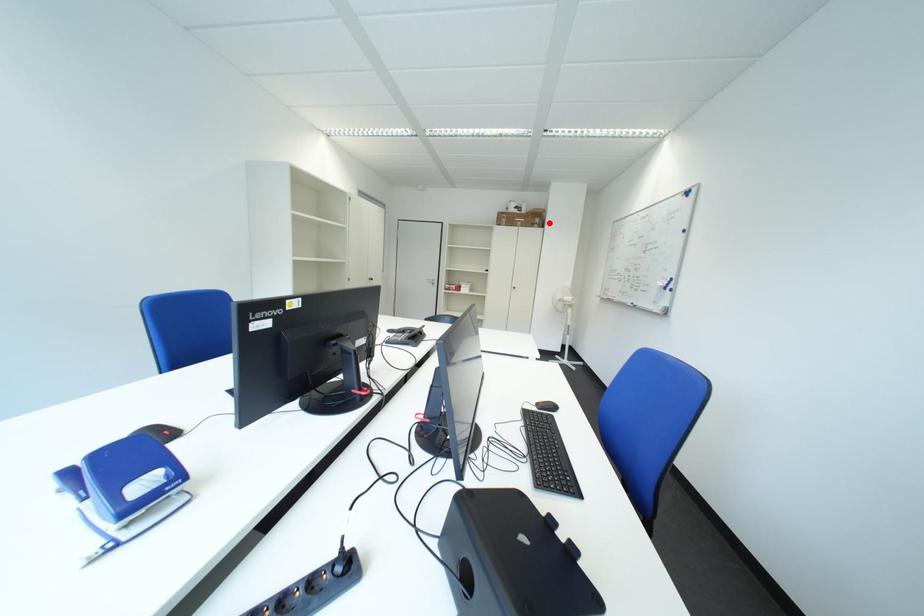
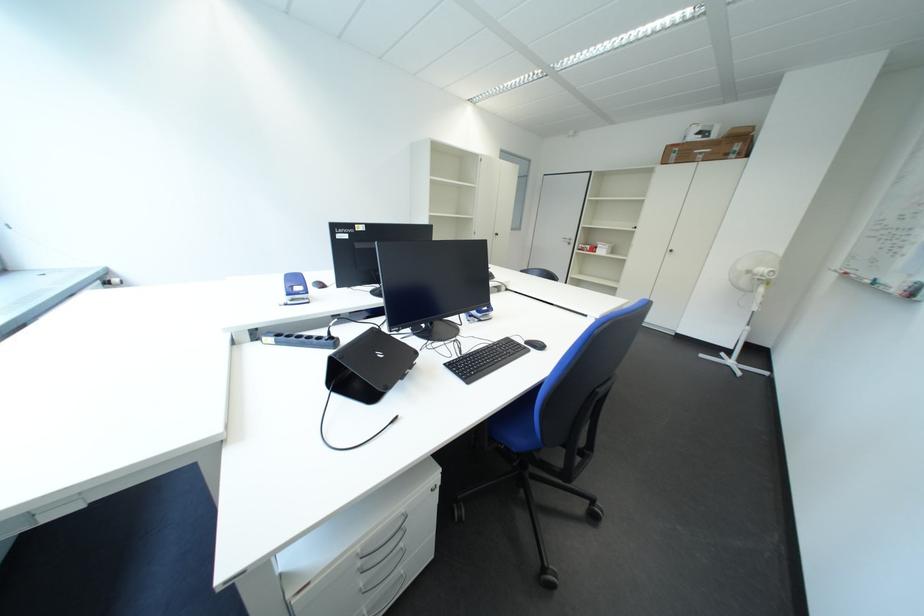
Find the pixel in the second image that matches the highlighted location in the first image.

(748, 150)